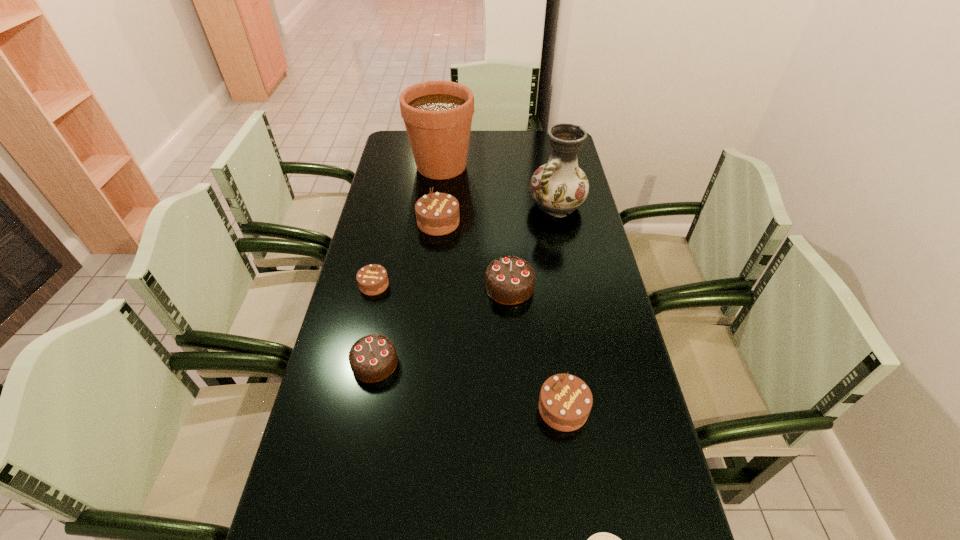
Find the location of a particular element. flowerpot is located at coordinates (438, 115).

Image resolution: width=960 pixels, height=540 pixels. In order to click on red vase in this screenshot , I will do click(558, 187).

At what (x,y) coordinates should I click in order to perform the action: click on the farthest chocolate cake. Please return your answer as a coordinate pair (x, y). Looking at the image, I should click on (437, 214).

At what (x,y) coordinates should I click in order to perform the action: click on the biggest brown chocolate cake. Please return your answer as a coordinate pair (x, y). Looking at the image, I should click on (437, 214).

You are a GUI agent. You are given a task and a screenshot of the screen. Output one action in this format:
    pyautogui.click(x=<x>, y=<y>)
    Task: Click on the farther chocolate chocolate cake
    This screenshot has height=540, width=960.
    Given the screenshot: What is the action you would take?
    pyautogui.click(x=510, y=280)

The image size is (960, 540). I want to click on the right chocolate chocolate cake, so click(x=510, y=280).

At what (x,y) coordinates should I click in order to perform the action: click on the seventh farthest object. Please return your answer as a coordinate pair (x, y). Looking at the image, I should click on (565, 401).

You are a GUI agent. You are given a task and a screenshot of the screen. Output one action in this format:
    pyautogui.click(x=<x>, y=<y>)
    Task: Click on the rightmost brown chocolate cake
    This screenshot has width=960, height=540.
    Given the screenshot: What is the action you would take?
    pyautogui.click(x=565, y=401)

I want to click on the smaller chocolate chocolate cake, so click(x=373, y=358).

Locate an element on the screen. The width and height of the screenshot is (960, 540). the nearer chocolate chocolate cake is located at coordinates (373, 358).